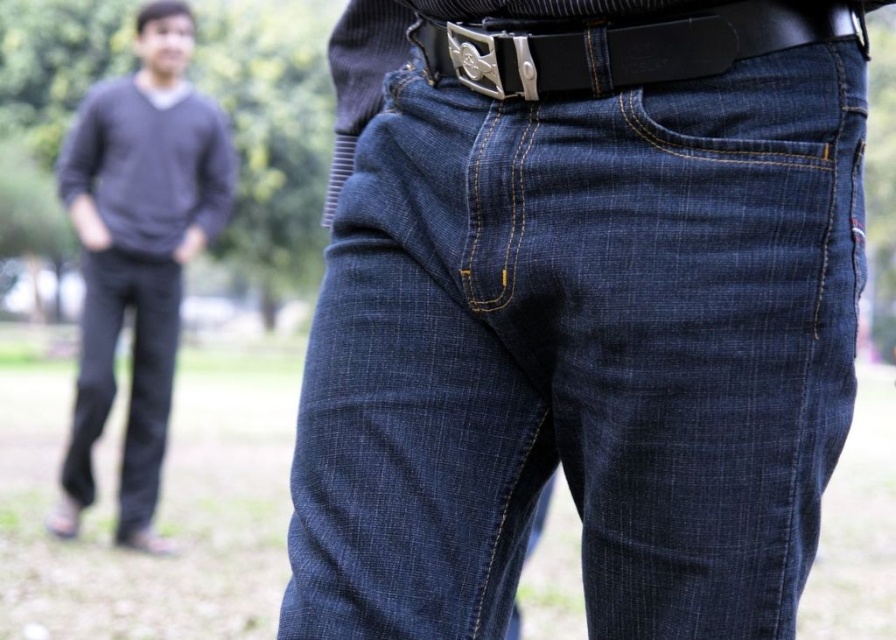
Is point (161, 259) in front of point (777, 8)?

No.

Is point (185, 252) closer to camera compared to point (707, 56)?

No, it is behind (707, 56).

Image resolution: width=896 pixels, height=640 pixels. In order to click on dark gray sweater at upper left in this screenshot , I will do `click(136, 253)`.

What do you see at coordinates (625, 45) in the screenshot?
I see `black leather belt at center` at bounding box center [625, 45].

Does black leather belt at center appear under dark blue denim jeans at lower left?

No, black leather belt at center is not below dark blue denim jeans at lower left.

What do you see at coordinates (625, 45) in the screenshot? The image size is (896, 640). I see `black leather belt at center` at bounding box center [625, 45].

Identify the location of black leather belt at center. (625, 45).

Is dark blue denim jeans at center below black leather belt at center?

Yes.

Based on the photo, is dark blue denim jeans at center shorter than black leather belt at center?

In fact, dark blue denim jeans at center may be taller than black leather belt at center.

Who is more forward, (595, 452) or (488, 26)?

Point (488, 26)

The height and width of the screenshot is (640, 896). Identify the location of dark blue denim jeans at center. (583, 353).